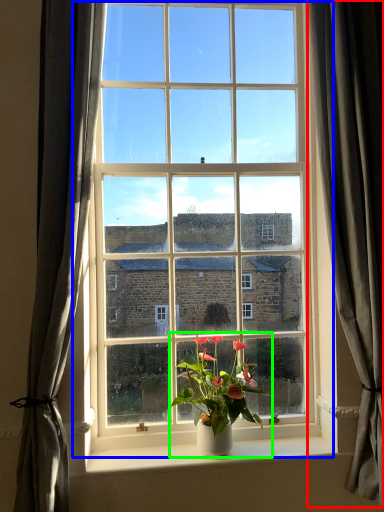
Question: Which object is positioned farthest from curtain (highlighted by a red box)? Select from window (highlighted by a blue box) and houseplant (highlighted by a green box).

Choices:
 (A) window
 (B) houseplant

Answer: (B)